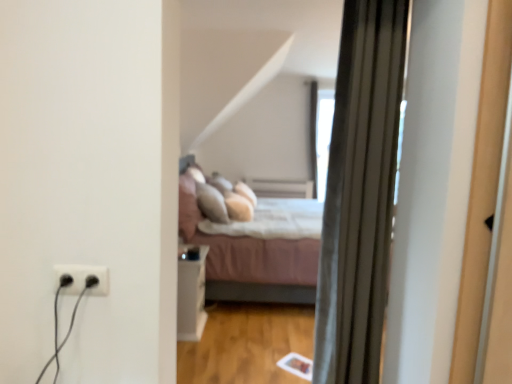
Question: Is black plastic outlet at lower left situated inside white glossy side table at center or outside?

Choices:
 (A) outside
 (B) inside

Answer: (A)

Question: From a real-world perspective, is black plastic outlet at lower left above or below white glossy side table at center?

Choices:
 (A) above
 (B) below

Answer: (A)

Question: Which object is the farthest from the pink fabric bed at center?

Choices:
 (A) white glossy side table at center
 (B) black plastic outlet at lower left
 (C) silky gray curtain at right

Answer: (B)

Question: Considering the real-world distances, which object is closest to the black plastic outlet at lower left?

Choices:
 (A) white glossy side table at center
 (B) pink fabric bed at center
 (C) silky gray curtain at right

Answer: (C)